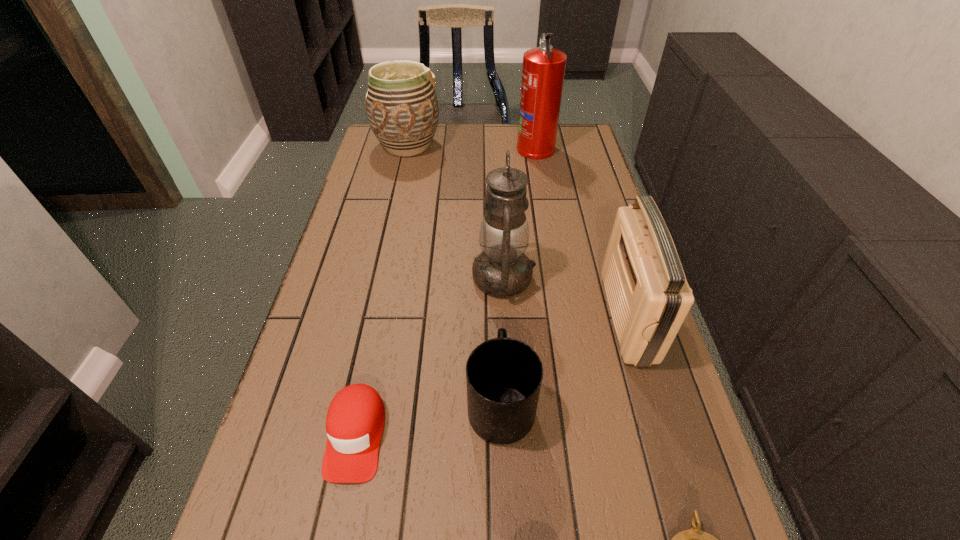
Where is `vacant space located 0.390m on the right of the pottery`? This screenshot has height=540, width=960. vacant space located 0.390m on the right of the pottery is located at coordinates (549, 146).

This screenshot has width=960, height=540. What are the coordinates of `free space located on the front-facing side of the radio receiver` in the screenshot? It's located at (493, 316).

Identify the location of free location located on the front-facing side of the radio receiver. (460, 316).

You are a GUI agent. You are given a task and a screenshot of the screen. Output one action in this format:
    pyautogui.click(x=<x>, y=<y>)
    Task: Click on the vacant area situated 0.090m on the front-facing side of the radio receiver
    
    Given the screenshot: What is the action you would take?
    pyautogui.click(x=570, y=316)

Find the location of a particular element. The height and width of the screenshot is (540, 960). vacant space located on the side of the mug with the handle is located at coordinates (496, 285).

Locate an element on the screen. Image resolution: width=960 pixels, height=540 pixels. vacant space located 0.100m on the side of the mug with the handle is located at coordinates (498, 329).

I want to click on free point located on the side of the mug with the handle, so click(498, 322).

Find the location of a particular element. The width and height of the screenshot is (960, 540). vacant space located 0.050m on the front-facing side of the shortest object is located at coordinates (340, 516).

This screenshot has height=540, width=960. Identify the location of fire extinguisher present at the far edge. (543, 70).

The height and width of the screenshot is (540, 960). Find the location of `pottery that is positioned at the far edge`. pottery that is positioned at the far edge is located at coordinates (402, 109).